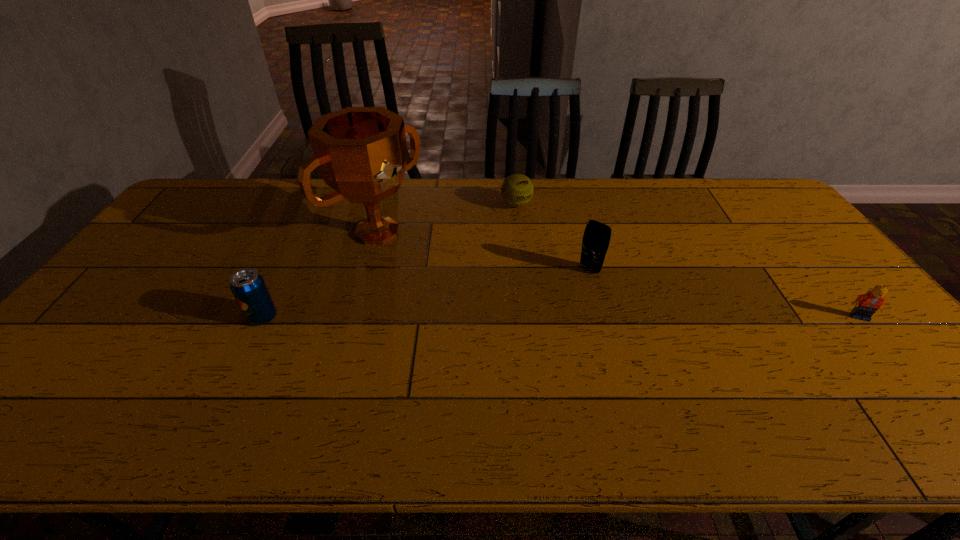
Find the location of a particular element. empty space between the leftmost object and the second object from left to right is located at coordinates (320, 274).

The image size is (960, 540). What are the coordinates of `free space between the rightmost object and the second object from left to right` in the screenshot? It's located at (618, 274).

Identify the location of vacant area between the third nearest object and the third shortest object. (426, 293).

The width and height of the screenshot is (960, 540). Identify the location of free spot between the third object from right to left and the award. (446, 218).

This screenshot has width=960, height=540. Identify the location of free space between the tallest object and the Lego. (618, 274).

The height and width of the screenshot is (540, 960). I want to click on free point between the third nearest object and the fourth object from right to left, so click(484, 251).

Identify the location of object that is the second closest to the third nearest object. This screenshot has width=960, height=540. (361, 153).

What are the coordinates of `object that ranks as the fourth closest to the Lego` in the screenshot? It's located at 247,285.

Identify the location of vacant region that satisfies the following two spatial constraints: 1. on the front side of the second object from left to right; 2. on the right side of the cellular telephone. This screenshot has width=960, height=540. (367, 269).

I want to click on vacant space that satisfies the following two spatial constraints: 1. on the back side of the third shortest object; 2. on the left side of the softball, so click(x=317, y=204).